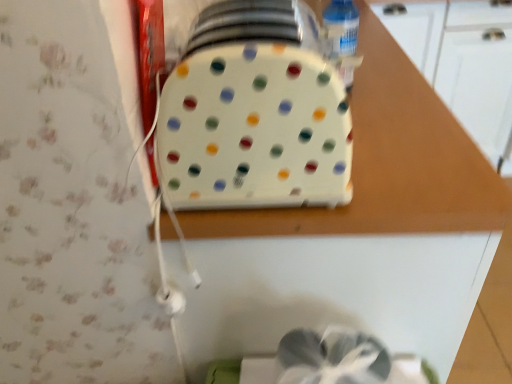
Question: Is clear plastic bottle at upper right spatially inside white plastic tray at center, or outside of it?

Choices:
 (A) outside
 (B) inside

Answer: (A)

Question: In terms of size, does clear plastic bottle at upper right appear bigger or smaller than white plastic tray at center?

Choices:
 (A) small
 (B) big

Answer: (A)

Question: Considering the real-world distances, which object is closest to the white plastic toaster at center?

Choices:
 (A) white plastic tray at center
 (B) clear plastic bottle at upper right

Answer: (A)

Question: Which is nearer to the white plastic tray at center?

Choices:
 (A) clear plastic bottle at upper right
 (B) white plastic toaster at center

Answer: (B)